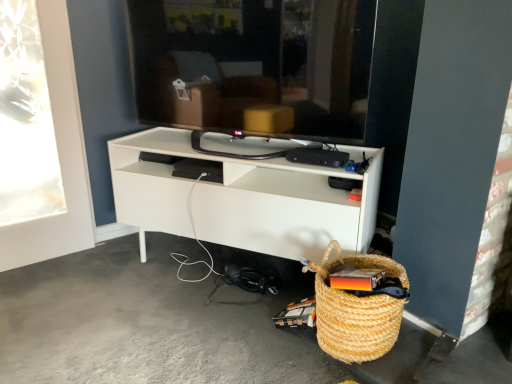
Locate an element on the screen. The height and width of the screenshot is (384, 512). empty space that is ontop of gray concrete floor at lower left (from a real-world perspective) is located at coordinates (165, 314).